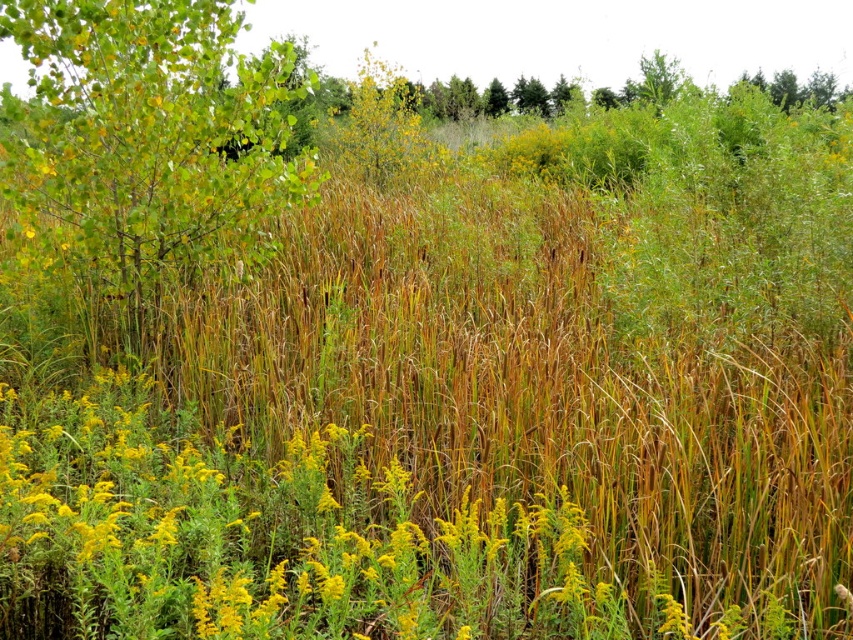
Image resolution: width=853 pixels, height=640 pixels. I want to click on yellow-green grass at center, so click(263, 536).

Is yellow-green grass at center below green leafy tree at upper left?

Correct, yellow-green grass at center is located below green leafy tree at upper left.

Identify the location of yellow-green grass at center. This screenshot has height=640, width=853. point(263,536).

Find the location of a particular element. This screenshot has height=640, width=853. yellow-green grass at center is located at coordinates 263,536.